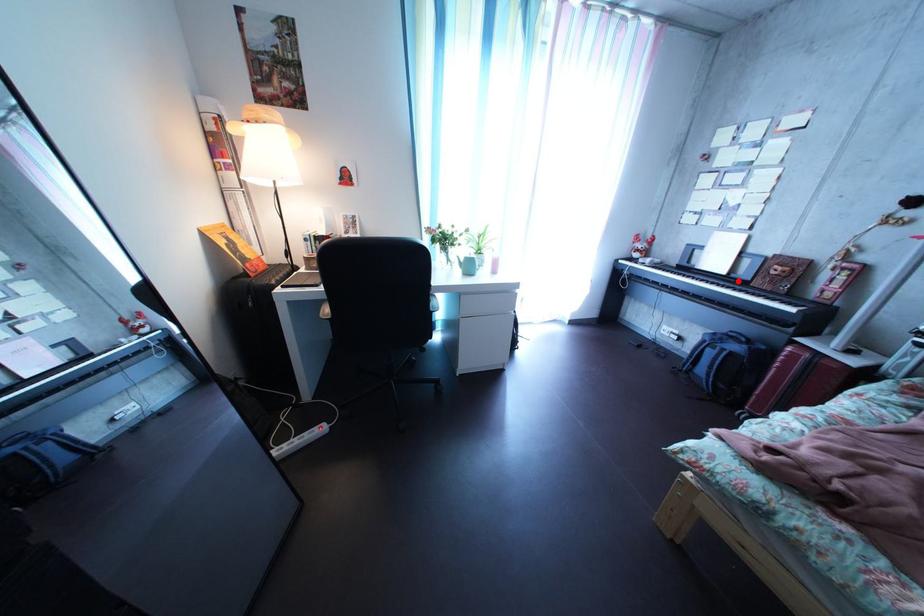
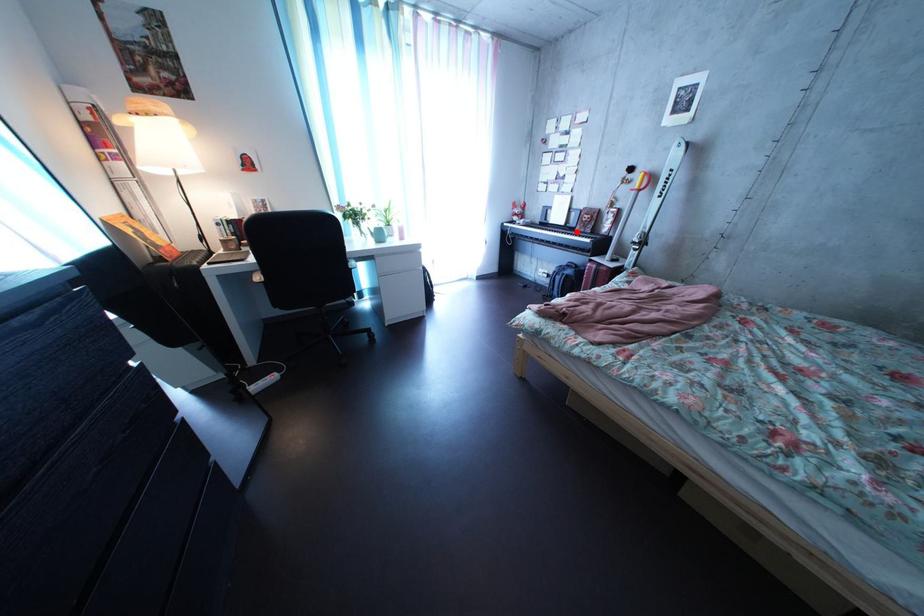
I am providing you with two images of the same scene from different viewpoints. A red point is marked on the first image and another point is marked on the second image. Are the points marked in image1 and image2 representing the same 3D position?

Yes